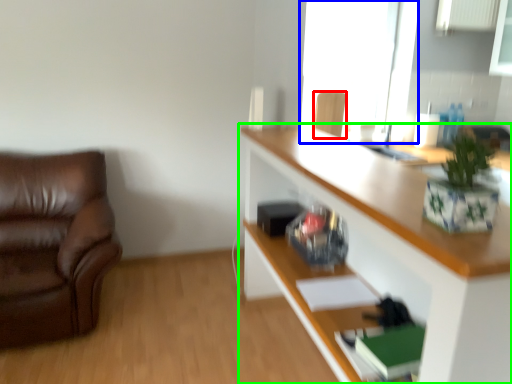
Question: Which object is the farthest from chair (highlighted by a red box)? Choose among these: window (highlighted by a blue box) or cabinetry (highlighted by a green box).

Choices:
 (A) window
 (B) cabinetry

Answer: (B)